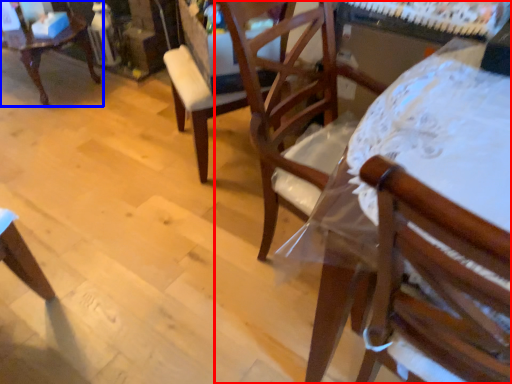
Question: Among these objects, which one is nearest to the camera, chair (highlighted by a red box) or chair (highlighted by a blue box)?

Choices:
 (A) chair
 (B) chair

Answer: (A)